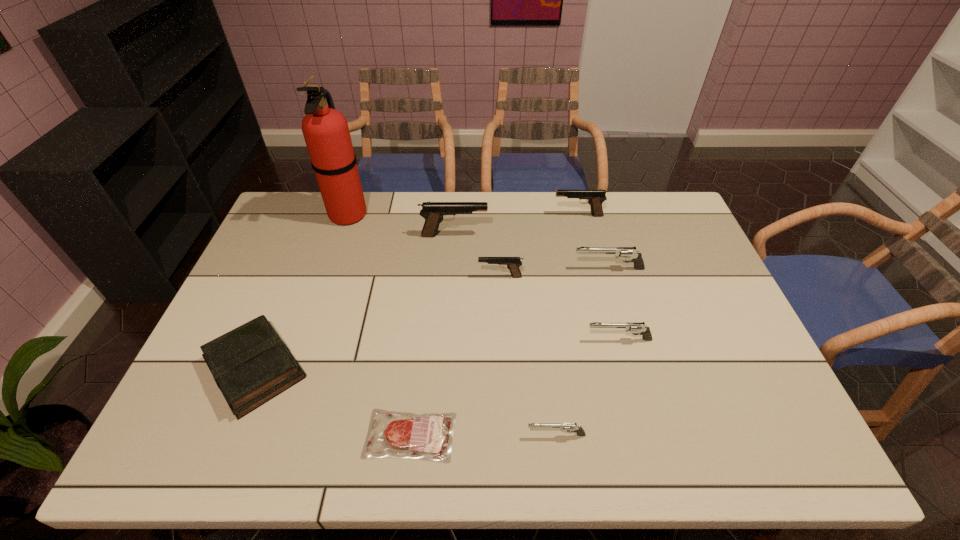
Identify the location of vacant space situated 0.150m on the back of the greenish book. (290, 286).

You are a GUI agent. You are given a task and a screenshot of the screen. Output one action in this format:
    pyautogui.click(x=<x>, y=<y>)
    Task: Click on the vacant area located on the front-facing side of the nearest silver pistol
    The image size is (960, 540).
    Given the screenshot: What is the action you would take?
    pyautogui.click(x=505, y=435)

Locate an element on the screen. This screenshot has height=540, width=960. vacant region located 0.280m on the front-facing side of the nearest silver pistol is located at coordinates (405, 435).

Find the location of `free spot located on the front-facing side of the nearest silver pistol`. free spot located on the front-facing side of the nearest silver pistol is located at coordinates (453, 435).

At what (x,y) coordinates should I click in order to perform the action: click on vacant space located 0.130m on the back of the steak. Please return your answer as a coordinate pair (x, y). Looking at the image, I should click on (419, 363).

The image size is (960, 540). Identify the location of fire extinguisher that is at the far edge. (325, 130).

Where is `pistol present at the near edge`? The height and width of the screenshot is (540, 960). pistol present at the near edge is located at coordinates (569, 427).

Locate an element on the screen. The height and width of the screenshot is (540, 960). steak that is at the near edge is located at coordinates (426, 436).

Locate an element on the screen. object situated at the left edge is located at coordinates (251, 364).

This screenshot has height=540, width=960. In order to click on free spot at the far edge of the desktop in this screenshot , I will do `click(492, 222)`.